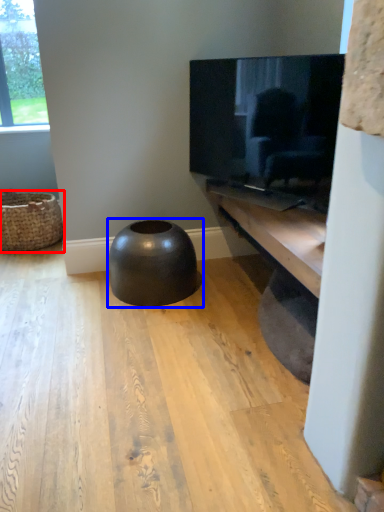
Question: Which object is closer to the camera taking this photo, basket (highlighted by a red box) or stool (highlighted by a blue box)?

Choices:
 (A) basket
 (B) stool

Answer: (B)